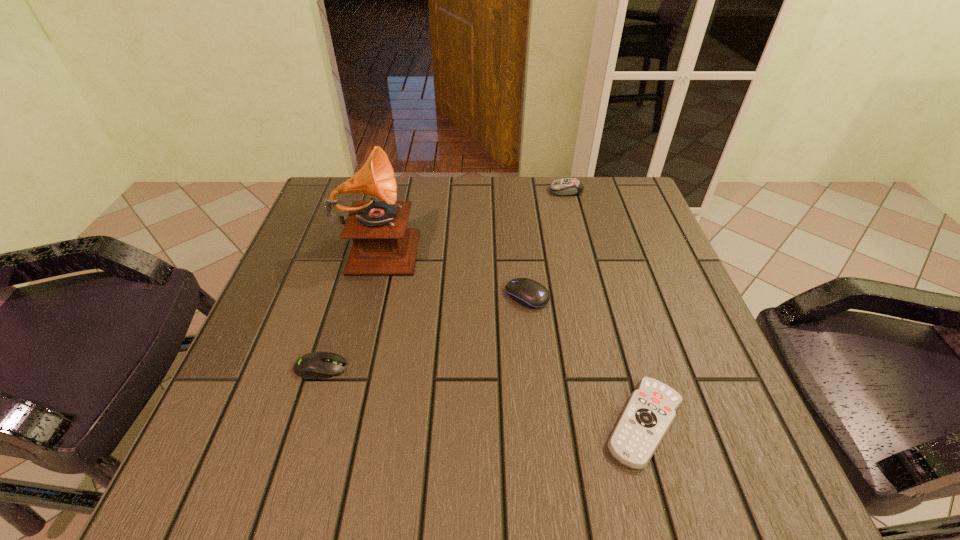
Find the location of a particular element. phonograph record present at the left edge is located at coordinates (382, 245).

Where is `computer mouse at the left edge`? The height and width of the screenshot is (540, 960). computer mouse at the left edge is located at coordinates (316, 365).

This screenshot has width=960, height=540. I want to click on computer mouse at the right edge, so click(x=567, y=186).

Locate an element on the screen. The image size is (960, 540). remote control at the right edge is located at coordinates (650, 411).

Where is `object at the far left corner`? The height and width of the screenshot is (540, 960). object at the far left corner is located at coordinates (382, 245).

This screenshot has height=540, width=960. I want to click on object located at the far right corner, so click(567, 186).

You are a GUI agent. You are given a task and a screenshot of the screen. Output one action in this format:
    pyautogui.click(x=<x>, y=<y>)
    Task: Click on the object that is at the near right corner
    
    Given the screenshot: What is the action you would take?
    pyautogui.click(x=650, y=411)

Identify the location of vacant space at the far edge of the desktop. Image resolution: width=960 pixels, height=540 pixels. (418, 227).

In order to click on free spot at the near edge of the desktop in this screenshot , I will do `click(433, 440)`.

In the image, there is a desktop. Where is `vacant space at the left edge`? vacant space at the left edge is located at coordinates (287, 278).